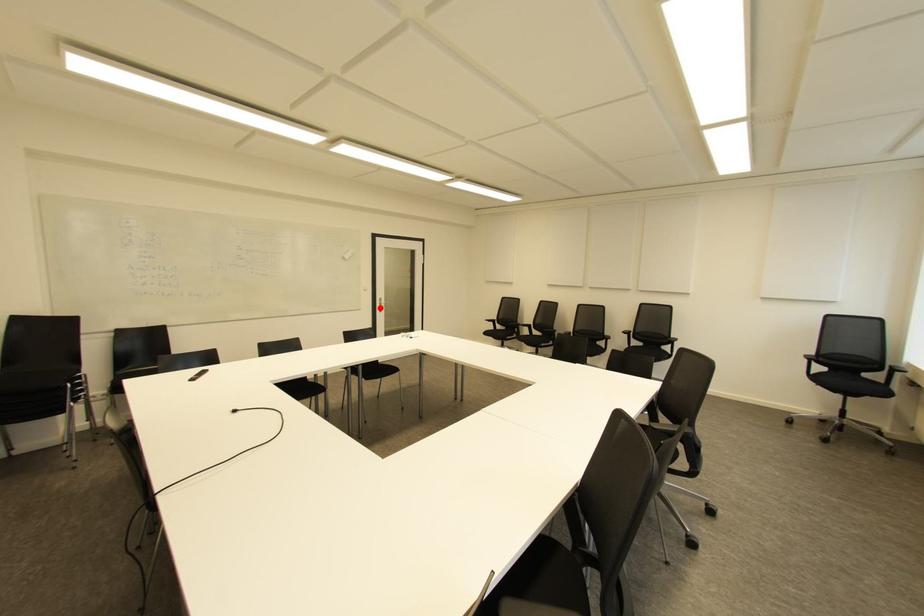
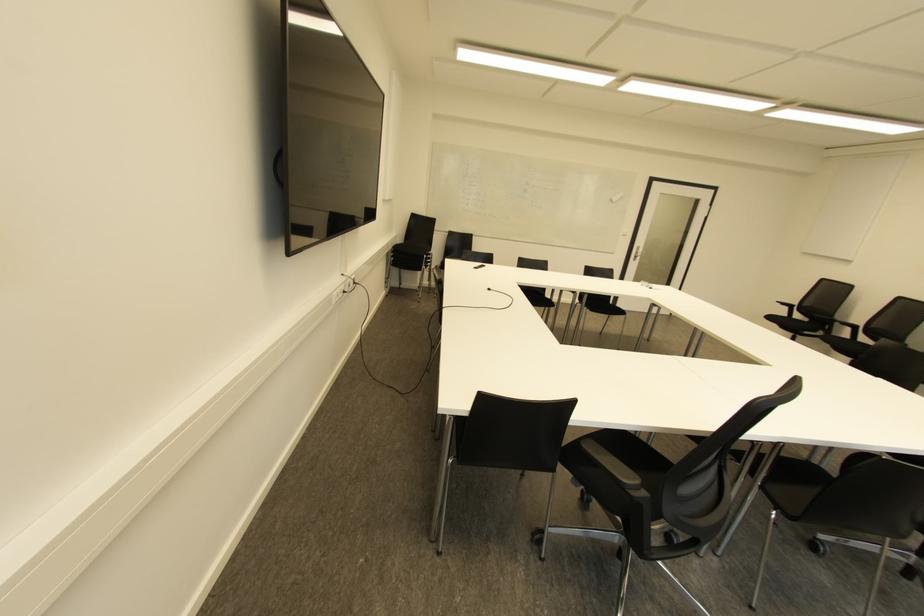
Find the pixel in the second image that matches the highlighted location in the first image.

(636, 257)